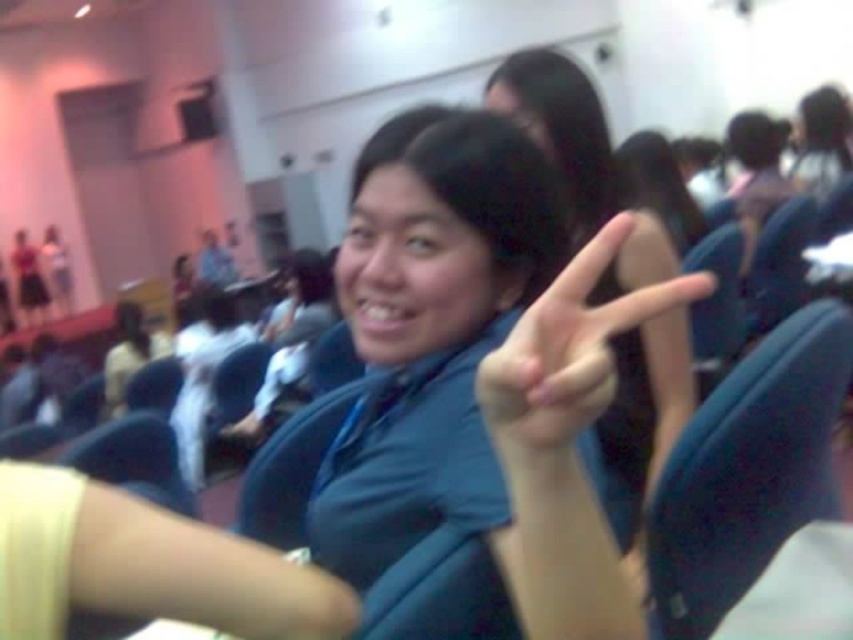
You are organizing a photo shoot and need to arrange two shirts for a display. The shirts are the blue fabric shirt at center and the matte blue shirt at center. Given their height difference, which shirt should be placed lower to ensure they are aligned properly?

The matte blue shirt at center should be placed lower because the blue fabric shirt at center is taller, so positioning the shorter matte blue shirt at center lower will align their tops properly.

You are organizing a photo shoot and need to arrange two shirts, the blue fabric shirt at center and the matte blue shirt at center, on a mannequin. If the mannequin can only fit one shirt at a time, which shirt should you choose to ensure it fits properly?

The blue fabric shirt at center is bigger than the matte blue shirt at center, so you should choose the matte blue shirt at center to ensure it fits properly on the mannequin.

You are attending an event and want to take a photo of the blue fabric shirt at center and the blue fabric chair at right. Which object will appear larger in your photo?

The blue fabric shirt at center will appear larger in the photo because it is closer to the viewer than the blue fabric chair at right.